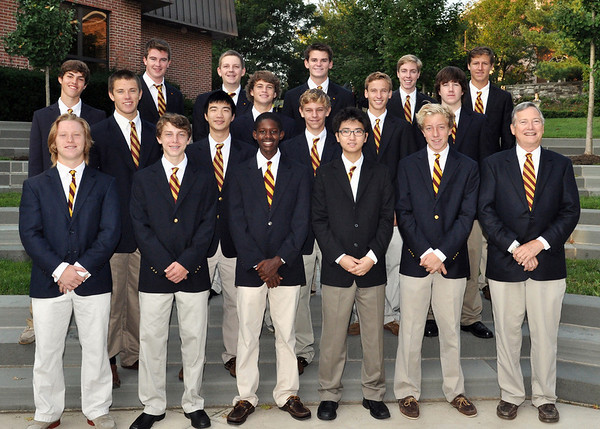
You are a GUI agent. You are given a task and a screenshot of the screen. Output one action in this format:
    pyautogui.click(x=<x>, y=<y>)
    Task: Click on the window
    
    Given the screenshot: What is the action you would take?
    pyautogui.click(x=92, y=40), pyautogui.click(x=72, y=22)